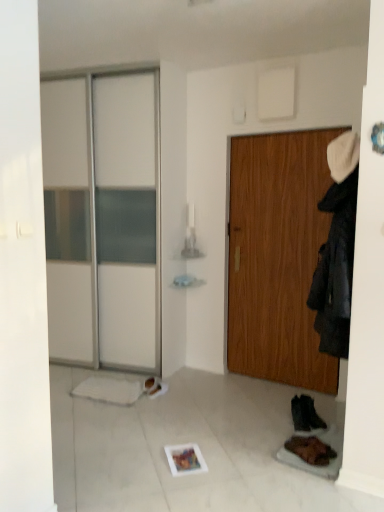
At what (x,y) coordinates should I click in order to perform the action: click on free space that is to the left of brown leather boot at lower right, the first footwear viewed from the front. Please return your answer as a coordinate pair (x, y). The height and width of the screenshot is (512, 384). Looking at the image, I should click on (286, 456).